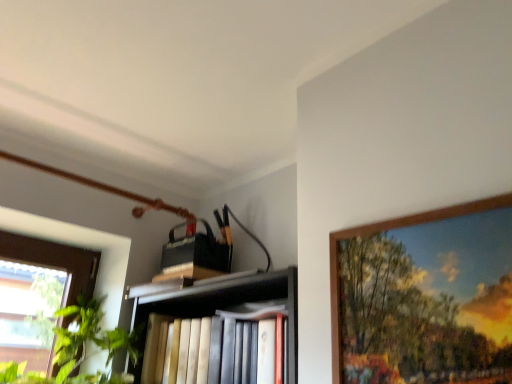
Question: Does wooden picture frame at upper right have a greater height compared to hardcover books at center?

Choices:
 (A) yes
 (B) no

Answer: (A)

Question: From the image's perspective, is wooden picture frame at upper right above hardcover books at center?

Choices:
 (A) no
 (B) yes

Answer: (B)

Question: Can hardcover books at center be found inside wooden picture frame at upper right?

Choices:
 (A) no
 (B) yes

Answer: (A)

Question: Is wooden picture frame at upper right to the right of hardcover books at center from the viewer's perspective?

Choices:
 (A) no
 (B) yes

Answer: (B)

Question: Is wooden picture frame at upper right not inside hardcover books at center?

Choices:
 (A) no
 (B) yes

Answer: (B)

Question: From the image's perspective, is wooden picture frame at upper right below hardcover books at center?

Choices:
 (A) no
 (B) yes

Answer: (A)

Question: Is hardcover books at center with wooden picture frame at upper right?

Choices:
 (A) no
 (B) yes

Answer: (A)

Question: Is hardcover books at center completely or partially outside of wooden picture frame at upper right?

Choices:
 (A) no
 (B) yes

Answer: (B)

Question: Does hardcover books at center have a greater width compared to wooden picture frame at upper right?

Choices:
 (A) no
 (B) yes

Answer: (B)

Question: From the image's perspective, is hardcover books at center located beneath wooden picture frame at upper right?

Choices:
 (A) yes
 (B) no

Answer: (A)

Question: Is wooden picture frame at upper right a part of hardcover books at center?

Choices:
 (A) no
 (B) yes

Answer: (A)

Question: Considering the relative positions of hardcover books at center and wooden picture frame at upper right in the image provided, is hardcover books at center to the right of wooden picture frame at upper right from the viewer's perspective?

Choices:
 (A) yes
 (B) no

Answer: (B)

Question: From a real-world perspective, is wooden picture frame at upper right physically located above or below hardcover books at center?

Choices:
 (A) above
 (B) below

Answer: (A)